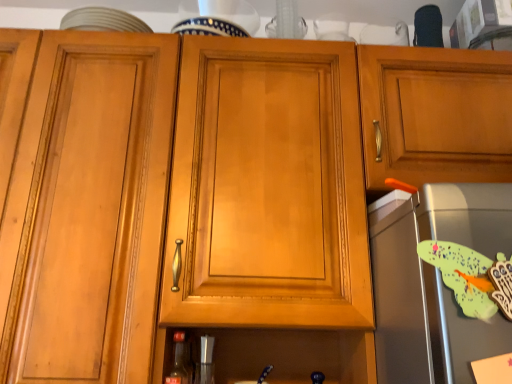
Question: Would you say metallic silver shaker at lower center, arranged as the first appliance when viewed from the left, is outside satin silver toaster at right, the 2th appliance positioned from the bottom?

Choices:
 (A) no
 (B) yes

Answer: (B)

Question: Considering the relative sizes of metallic silver shaker at lower center, the first appliance ordered from the bottom, and satin silver toaster at right, acting as the first appliance starting from the right, in the image provided, is metallic silver shaker at lower center, the first appliance ordered from the bottom, smaller than satin silver toaster at right, acting as the first appliance starting from the right,?

Choices:
 (A) no
 (B) yes

Answer: (B)

Question: Is the position of metallic silver shaker at lower center, which ranks as the 2th appliance in front-to-back order, less distant than that of satin silver toaster at right, the 2th appliance positioned from the bottom?

Choices:
 (A) yes
 (B) no

Answer: (B)

Question: Considering the relative positions of metallic silver shaker at lower center, the first appliance positioned from the back, and satin silver toaster at right, the 2th appliance positioned from the bottom, in the image provided, is metallic silver shaker at lower center, the first appliance positioned from the back, to the left of satin silver toaster at right, the 2th appliance positioned from the bottom, from the viewer's perspective?

Choices:
 (A) no
 (B) yes

Answer: (B)

Question: From a real-world perspective, is metallic silver shaker at lower center, positioned as the 2th appliance in right-to-left order, positioned over satin silver toaster at right, positioned as the 1th appliance in front-to-back order, based on gravity?

Choices:
 (A) yes
 (B) no

Answer: (B)

Question: Is metallic silver shaker at lower center, positioned as the 2th appliance in right-to-left order, in contact with satin silver toaster at right, acting as the first appliance starting from the right?

Choices:
 (A) no
 (B) yes

Answer: (A)

Question: From a real-world perspective, is matte glass bottle at lower center on top of satin silver toaster at right, the 1th appliance viewed from the top?

Choices:
 (A) yes
 (B) no

Answer: (B)

Question: Is the position of matte glass bottle at lower center less distant than that of satin silver toaster at right, positioned as the 1th appliance in front-to-back order?

Choices:
 (A) no
 (B) yes

Answer: (A)

Question: Is matte glass bottle at lower center facing towards satin silver toaster at right, the 2th appliance positioned from the bottom?

Choices:
 (A) no
 (B) yes

Answer: (A)

Question: Does matte glass bottle at lower center have a smaller size compared to satin silver toaster at right, the 1th appliance viewed from the top?

Choices:
 (A) yes
 (B) no

Answer: (A)

Question: Can you confirm if matte glass bottle at lower center is positioned to the right of satin silver toaster at right, acting as the first appliance starting from the right?

Choices:
 (A) yes
 (B) no

Answer: (B)

Question: Can satin silver toaster at right, positioned as the 1th appliance in front-to-back order, be found inside matte glass bottle at lower center?

Choices:
 (A) yes
 (B) no

Answer: (B)

Question: Is satin silver toaster at right, the 1th appliance viewed from the top, oriented towards matte glass bottle at lower center?

Choices:
 (A) yes
 (B) no

Answer: (B)